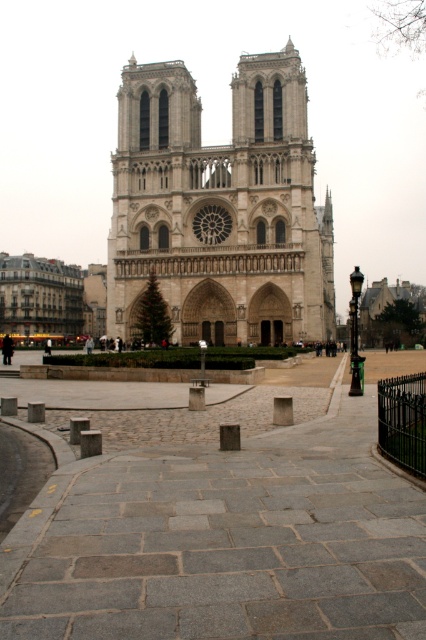
You are standing in the square in front of Notre Dame Cathedral. You see two points marked in the image. Which point is closer to you? The points are point (393, 593) and point (121, 236).

Point (393, 593) is closer to the viewer than point (121, 236).

In the scene shown: You are a tourist standing on the gray stone plaza at center. You want to take a photo of the stone gothic cathedral at center without any obstructions. Which direction should you face?

The gray stone plaza at center is in front of the stone gothic cathedral at center, so you should face away from the cathedral to avoid having the plaza block your view. Alternatively, you can move to a higher vantage point to capture the cathedral without the plaza in the foreground.